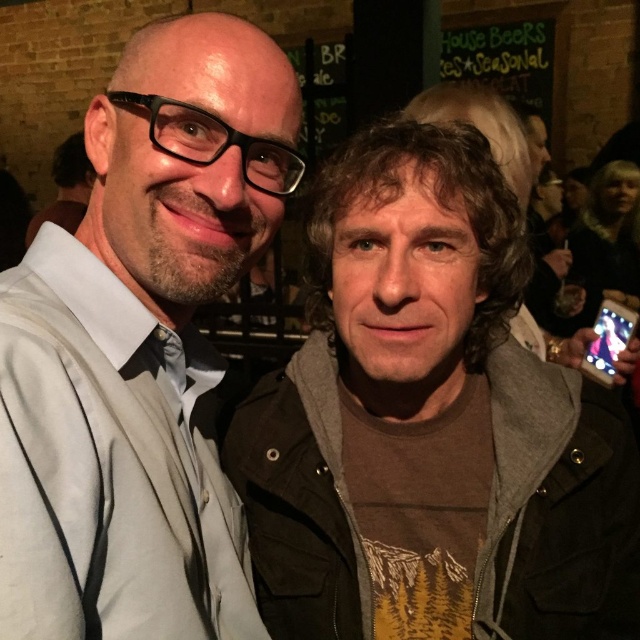
You are a photographer trying to focus on the brown cotton shirt at center and the matte black jacket at left. Which of these two items is closer to your camera lens?

The brown cotton shirt at center is closer to the camera lens because it is further to the viewer than the matte black jacket at left.

You are standing in front of the two people in the image. You want to hand a gift to the person wearing the brown cotton shirt at center. Which direction should you move to reach them?

The brown cotton shirt at center is located at point 0.642 on the x axis and 0.669 on the y axis, so you should move towards the center of the image to reach them.